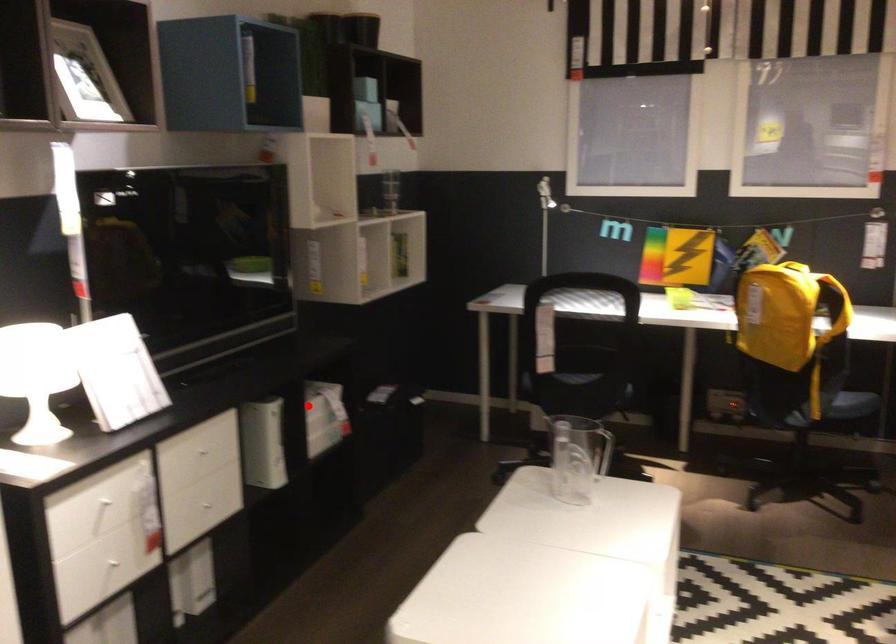
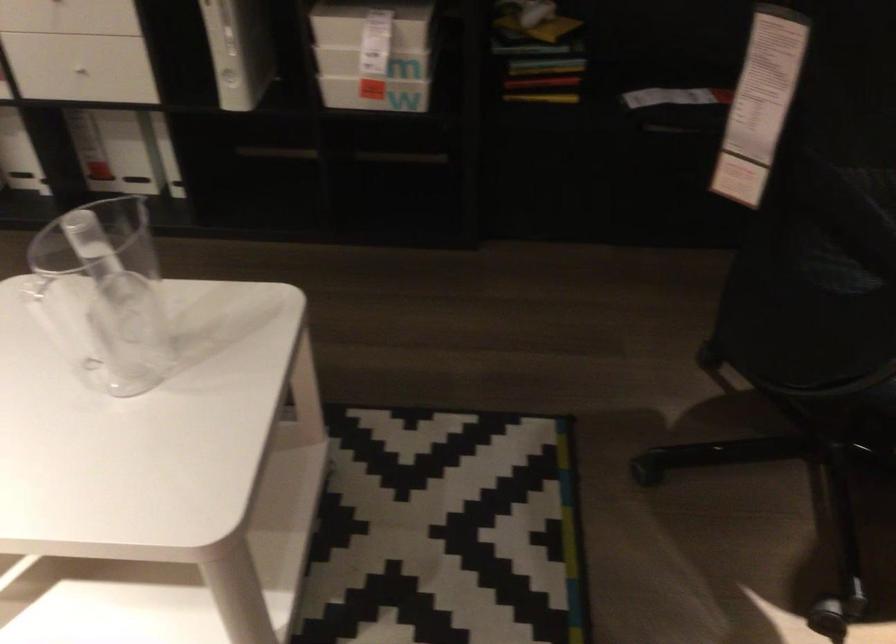
Where in the second image is the point corresponding to the highlighted location from the first image?

(371, 24)